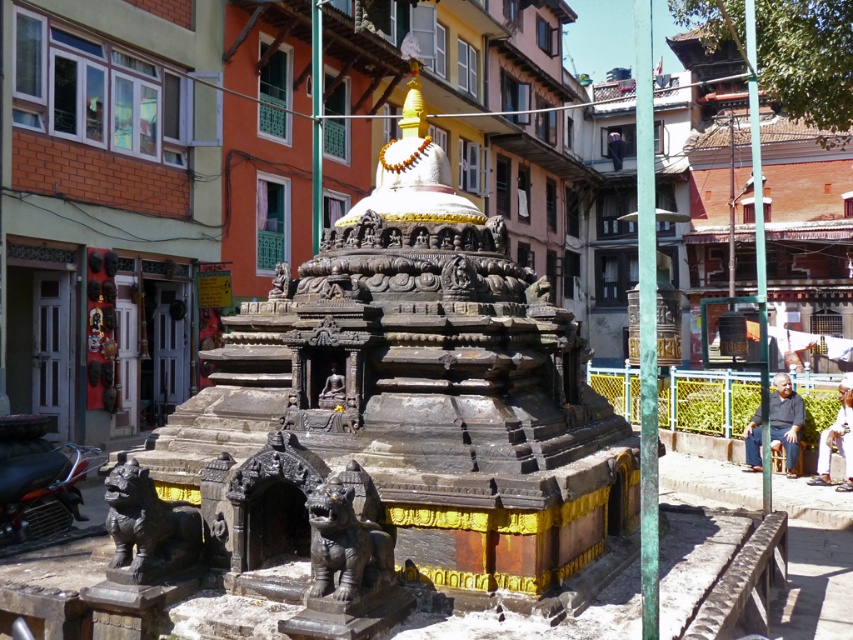
Between shiny black motorcycle at lower left and bronze statue at center, which one appears on the right side from the viewer's perspective?

Positioned to the right is bronze statue at center.

Between shiny black motorcycle at lower left and bronze statue at center, which one has more height?

bronze statue at center is taller.

The height and width of the screenshot is (640, 853). Identify the location of shiny black motorcycle at lower left. pyautogui.click(x=45, y=499).

This screenshot has width=853, height=640. Find the location of `polished bronze lion at lower left`. polished bronze lion at lower left is located at coordinates (148, 528).

Who is higher up, polished bronze lion at lower left or matte bronze statue at center?

matte bronze statue at center is higher up.

Describe the element at coordinates (148, 528) in the screenshot. This screenshot has height=640, width=853. I see `polished bronze lion at lower left` at that location.

This screenshot has height=640, width=853. I want to click on polished bronze lion at lower left, so click(x=148, y=528).

Between point (125, 572) and point (18, 512), which one is positioned behind?

Positioned behind is point (18, 512).

Does polished bronze lion at lower left have a lesser height compared to shiny black motorcycle at lower left?

No, polished bronze lion at lower left is not shorter than shiny black motorcycle at lower left.

Between point (136, 524) and point (54, 477), which one is positioned in front?

Positioned in front is point (136, 524).

At what (x,y) coordinates should I click in order to perform the action: click on polished bronze lion at lower left. Please return your answer as a coordinate pair (x, y). The image size is (853, 640). Looking at the image, I should click on (148, 528).